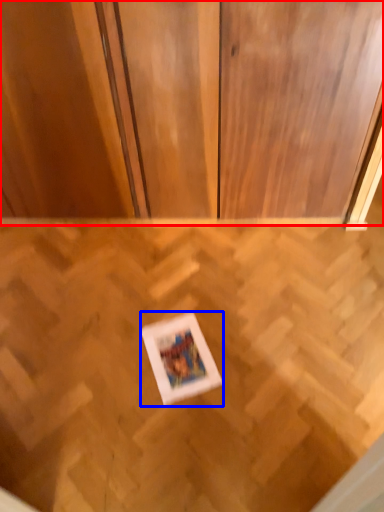
Question: Which object is further to the camera taking this photo, dresser (highlighted by a red box) or picture frame (highlighted by a blue box)?

Choices:
 (A) dresser
 (B) picture frame

Answer: (B)